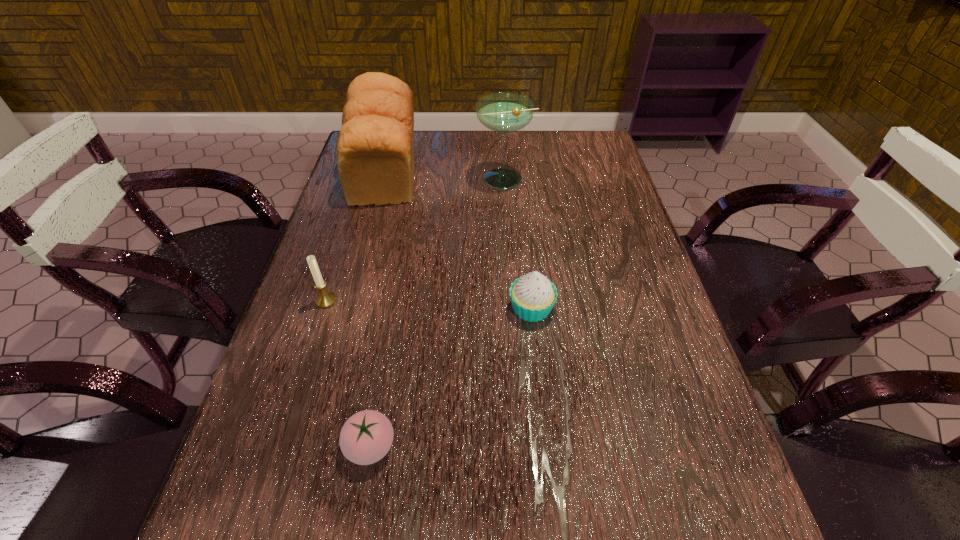
Locate an element on the screen. The width and height of the screenshot is (960, 540). free space between the candle holder and the nearest object is located at coordinates (x=348, y=374).

Locate an element on the screen. Image resolution: width=960 pixels, height=540 pixels. vacant area that lies between the bread and the martini is located at coordinates (444, 174).

At what (x,y) coordinates should I click in order to perform the action: click on free space that is in between the second shortest object and the candle holder. Please return your answer as a coordinate pair (x, y). The width and height of the screenshot is (960, 540). Looking at the image, I should click on (429, 305).

You are a GUI agent. You are given a task and a screenshot of the screen. Output one action in this format:
    pyautogui.click(x=<x>, y=<y>)
    Task: Click on the free space between the third tallest object and the bread
    The height and width of the screenshot is (540, 960).
    Given the screenshot: What is the action you would take?
    pyautogui.click(x=356, y=235)

You are a GUI agent. You are given a task and a screenshot of the screen. Output one action in this format:
    pyautogui.click(x=<x>, y=<y>)
    Task: Click on the free spot between the bread and the cupcake
    
    Given the screenshot: What is the action you would take?
    pyautogui.click(x=458, y=239)

Image resolution: width=960 pixels, height=540 pixels. In order to click on blank region between the bread and the martini in this screenshot , I will do [x=444, y=174].

Choose which object is the second nearest neighbor to the third tallest object. Please provide its 2D coordinates. Your answer should be formatted as a tuple, i.e. [(x, y)], where the tuple contains the x and y coordinates of a point satisfying the conditions above.

[(375, 148)]

In order to click on object that can be found as the second closest to the third tallest object in this screenshot , I will do `click(375, 148)`.

Where is `free spot that satisfies the following two spatial constraints: 1. on the back side of the martini; 2. on the right side of the tomato`? free spot that satisfies the following two spatial constraints: 1. on the back side of the martini; 2. on the right side of the tomato is located at coordinates (418, 179).